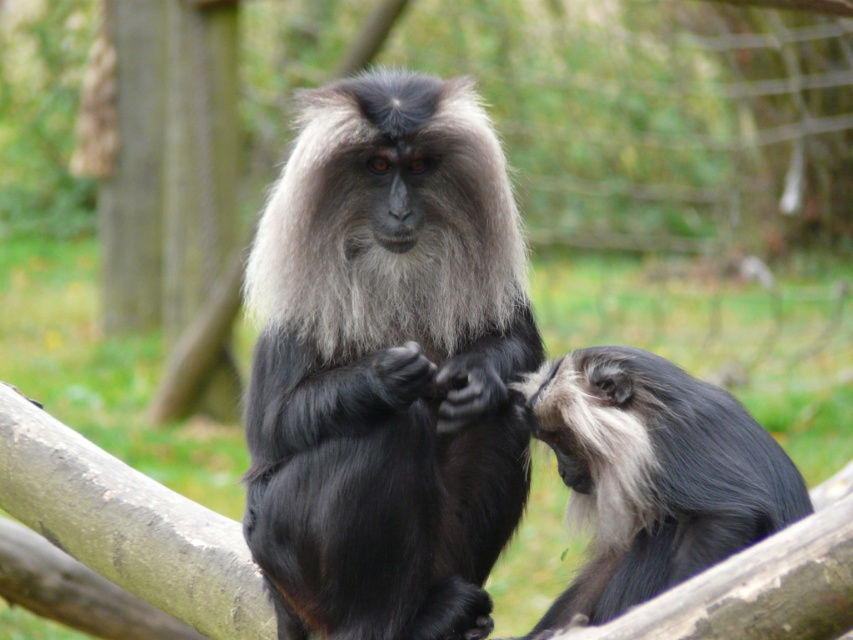
You are a GUI agent. You are given a task and a screenshot of the screen. Output one action in this format:
    pyautogui.click(x=<x>, y=<y>)
    Task: Click on the black fur monkey at center
    The width and height of the screenshot is (853, 640).
    Given the screenshot: What is the action you would take?
    pyautogui.click(x=386, y=365)